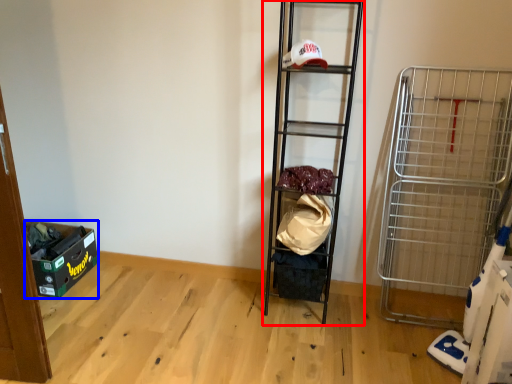
Question: Which point is further to the camera, shelf (highlighted by a red box) or storage box (highlighted by a blue box)?

Choices:
 (A) shelf
 (B) storage box

Answer: (B)